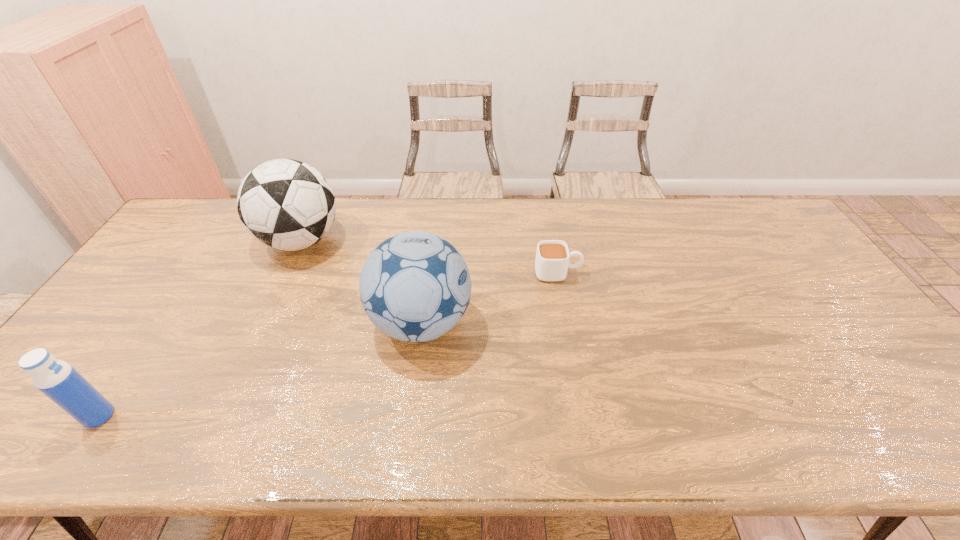
Image resolution: width=960 pixels, height=540 pixels. In order to click on free location that satisfies the following two spatial constraints: 1. on the side with the handle of the rightmost object; 2. on the front side of the nearest object in this screenshot , I will do `click(585, 416)`.

What are the coordinates of `vacant area that satisfies the following two spatial constraints: 1. on the side with brand of the right soccer ball; 2. on the front side of the leftmost object` in the screenshot? It's located at (410, 416).

What are the coordinates of `free region that satisfies the following two spatial constraints: 1. on the side with brand of the second nearest object; 2. on the front side of the nearest object` in the screenshot? It's located at (410, 416).